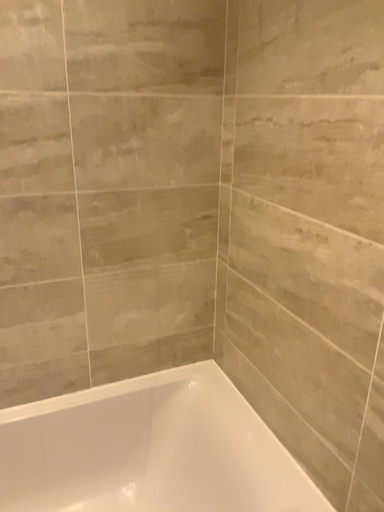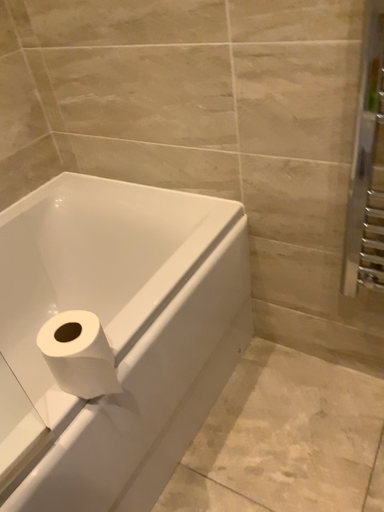
Question: How did the camera likely rotate when shooting the video?

Choices:
 (A) rotated left
 (B) rotated right

Answer: (B)